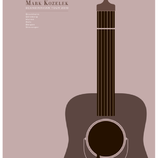
At what (x,y) coordinates should I click in order to perform the action: click on rosette. Please return your answer as a coordinate pair (x, y). Looking at the image, I should click on (85, 135).